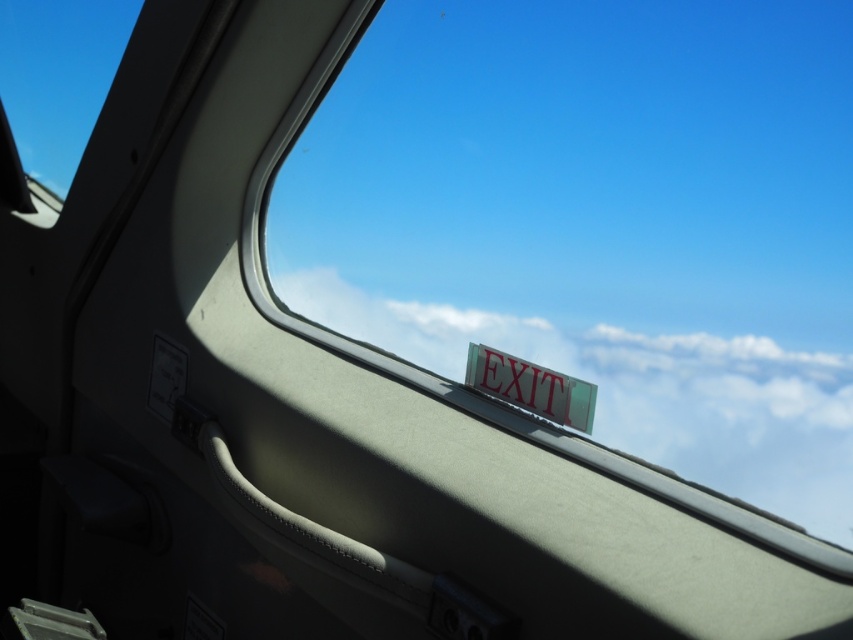
Question: Which of the following is the farthest from the observer?

Choices:
 (A) (723, 424)
 (B) (73, 19)

Answer: (B)

Question: Does transparent glass window at upper left lie in front of red plastic exit sign at upper right?

Choices:
 (A) yes
 (B) no

Answer: (B)

Question: Is white fluffy cloud at upper center thinner than transparent glass window at upper left?

Choices:
 (A) no
 (B) yes

Answer: (A)

Question: Which of the following is the closest to the observer?

Choices:
 (A) red plastic exit sign at upper right
 (B) transparent glass window at upper left
 (C) white fluffy cloud at upper center

Answer: (C)

Question: Does white fluffy cloud at upper center appear on the right side of red plastic exit sign at upper right?

Choices:
 (A) no
 (B) yes

Answer: (A)

Question: Which of the following is the closest to the observer?

Choices:
 (A) (735, 362)
 (B) (78, 132)

Answer: (A)